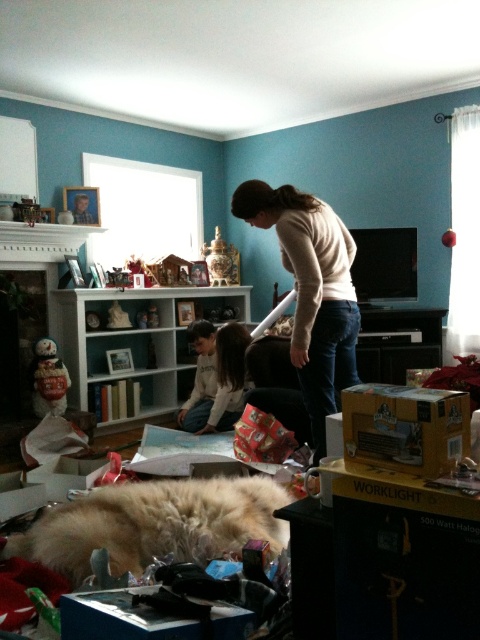
Question: Estimate the real-world distances between objects in this image. Which object is farther from the white ceramic snowman at lower left?

Choices:
 (A) yellow cardboard box at lower right
 (B) white soft sweater at center
 (C) porcelain vase at center
 (D) blue cardboard box at lower center

Answer: (A)

Question: Does yellow cardboard box at lower right appear under white ceramic snowman at lower left?

Choices:
 (A) yes
 (B) no

Answer: (B)

Question: Among these points, which one is nearest to the camera?

Choices:
 (A) (231, 269)
 (B) (46, 342)
 (C) (243, 380)
 (D) (286, 268)

Answer: (D)

Question: Does light beige sweater at center appear under white ceramic snowman at lower left?

Choices:
 (A) yes
 (B) no

Answer: (B)

Question: Which point appears closest to the camera in this image?

Choices:
 (A) (90, 637)
 (B) (217, 246)
 (C) (218, 348)

Answer: (A)

Question: In this image, where is blue cardboard box at lower center located relative to white ceramic snowman at lower left?

Choices:
 (A) below
 (B) above

Answer: (A)